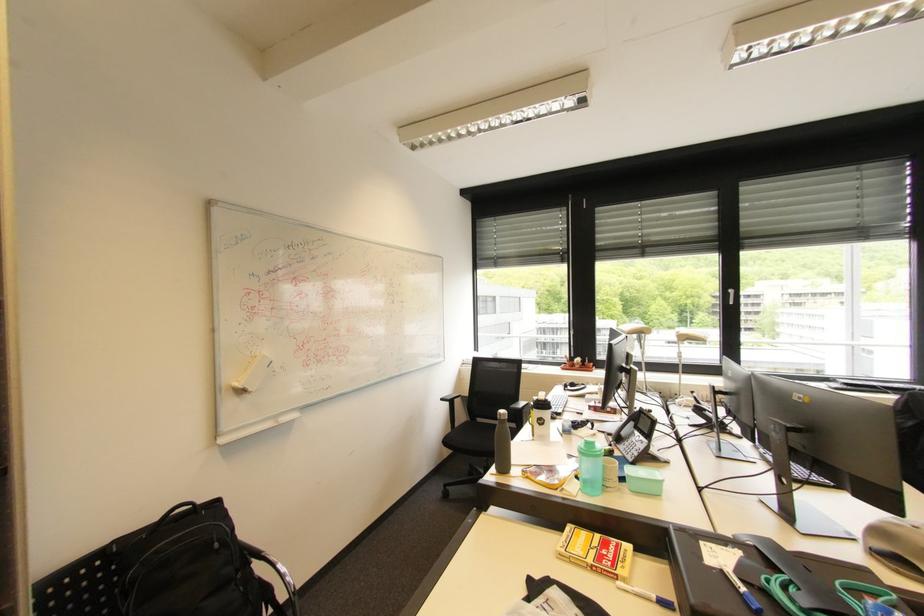
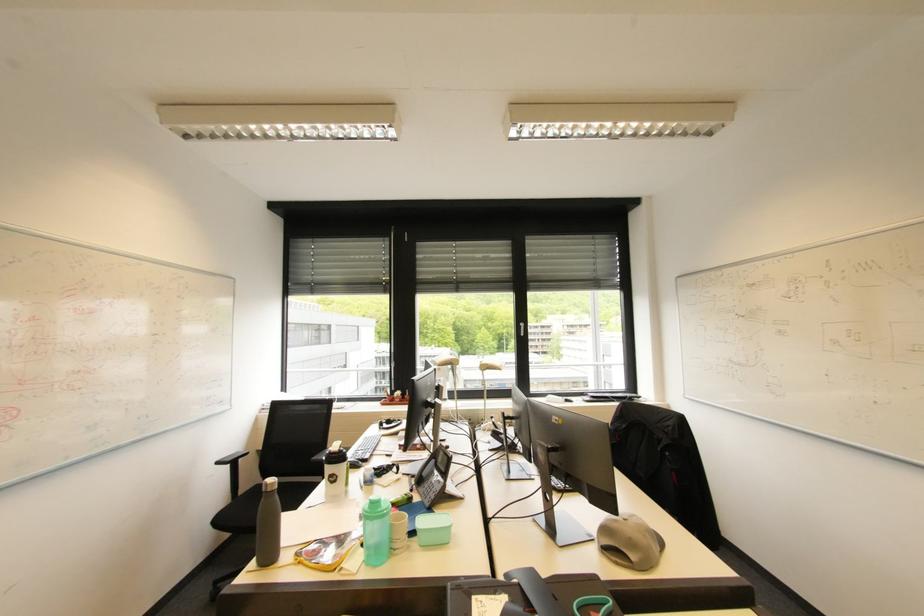
Question: The camera is either moving clockwise (left) or counter-clockwise (right) around the object. The first image is from the beginning of the video and the second image is from the end. Is the camera moving left or right when shooting the video?

Choices:
 (A) Left
 (B) Right

Answer: (A)